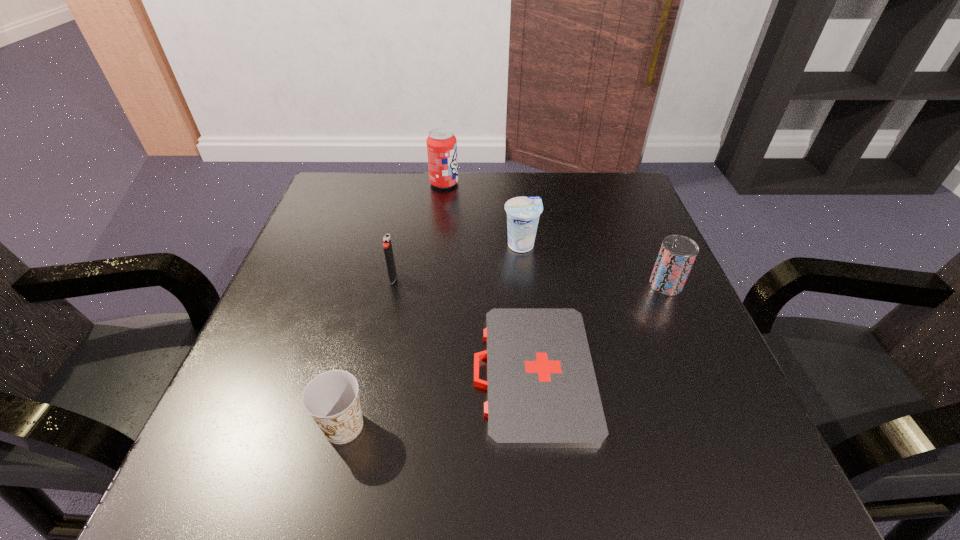
What are the coordinates of `object located at the near left corner` in the screenshot? It's located at (332, 399).

I want to click on vacant position at the far edge of the desktop, so click(x=497, y=200).

Where is `free spot at the near edge of the desktop`? This screenshot has width=960, height=540. free spot at the near edge of the desktop is located at coordinates (324, 485).

Where is `vacant space at the left edge`? The height and width of the screenshot is (540, 960). vacant space at the left edge is located at coordinates (329, 256).

This screenshot has height=540, width=960. I want to click on vacant space at the far left corner of the desktop, so click(381, 176).

Image resolution: width=960 pixels, height=540 pixels. I want to click on vacant region at the far right corner of the desktop, so click(645, 210).

Image resolution: width=960 pixels, height=540 pixels. What are the coordinates of `vacant position at the near right corner of the desktop` in the screenshot? It's located at (749, 486).

This screenshot has height=540, width=960. Identify the location of free space between the Dixie cup and the fifth nearest object. [432, 335].

Find the location of a particular element. This screenshot has width=960, height=540. free space between the shortest object and the igniter is located at coordinates (463, 325).

Image resolution: width=960 pixels, height=540 pixels. I want to click on empty space that is in between the Dixie cup and the soda can, so [394, 305].